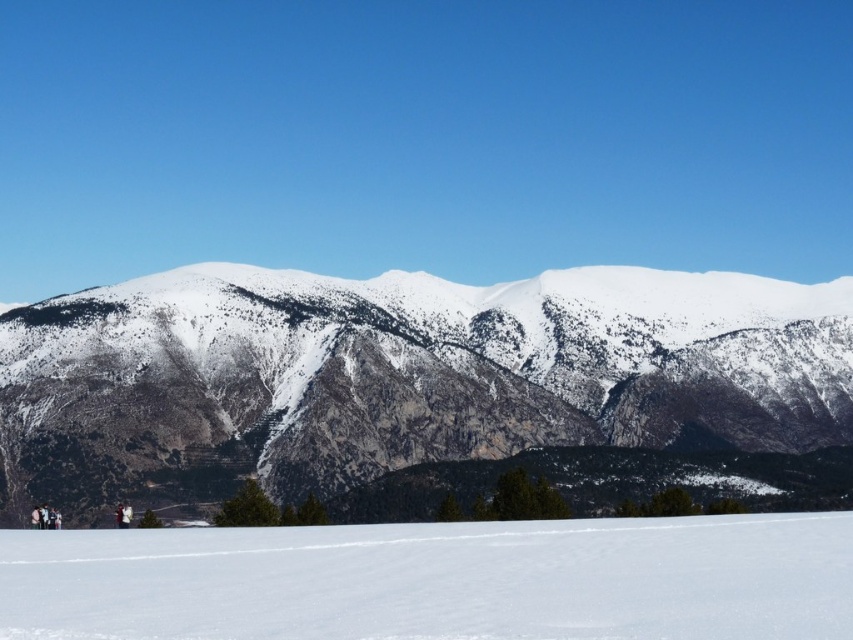
You are planning to ski down the white snow ski slope at lower center. There is a white rocky mountain at center in the background. Which direction should you face to avoid hitting the mountain while skiing?

You should face downward because the white rocky mountain at center is located above the white snow ski slope at lower center, so facing downward will keep you away from the mountain.

You are a hiker planning to hike to the white rocky mountain at center. You see a point marked at coordinates (410, 371). Is this point likely the location of the mountain?

Yes, the white rocky mountain at center is represented by point (410, 371), so this point is likely the location of the mountain.

You are planning to take a photo of the white rocky mountain at center and the white snow ski slope at lower center. Which object should you focus on first if you want to capture both in a single frame without moving the camera?

The white rocky mountain at center is taller than the white snow ski slope at lower center, so you should focus on the white rocky mountain at center first to ensure it fits within the frame.